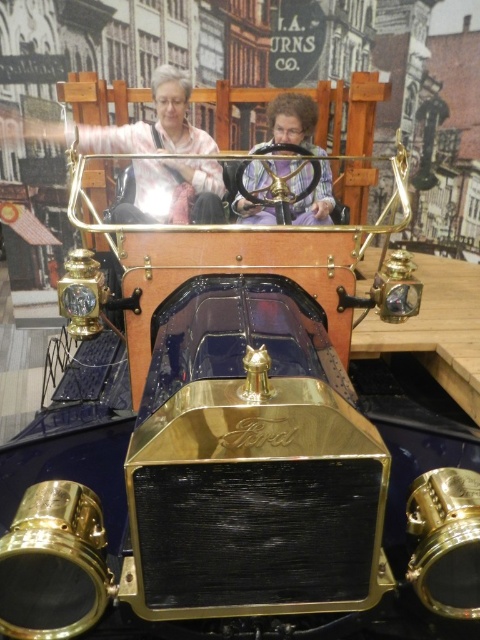
Who is taller, matte pink sweater at upper center or purple fabric at center?

matte pink sweater at upper center is taller.

Does matte pink sweater at upper center have a larger size compared to purple fabric at center?

Correct, matte pink sweater at upper center is larger in size than purple fabric at center.

Is point (172, 220) positioned after point (328, 198)?

No, it is in front of (328, 198).

The width and height of the screenshot is (480, 640). I want to click on matte pink sweater at upper center, so click(x=172, y=193).